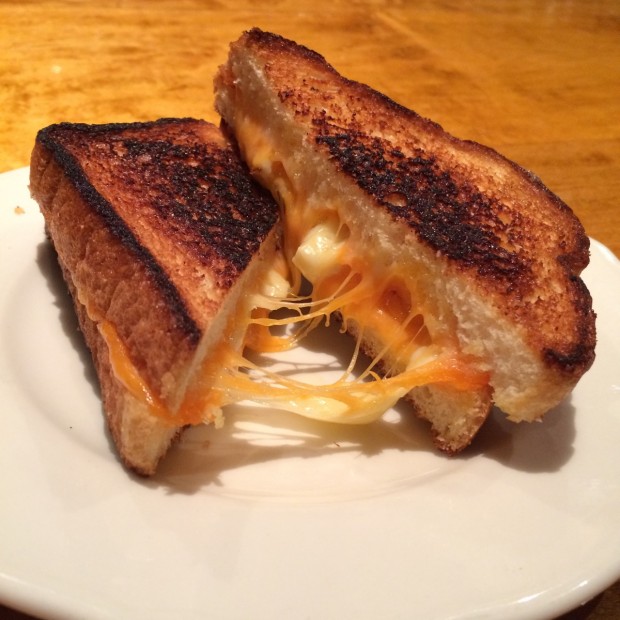
Where is `table wooden`? This screenshot has height=620, width=620. table wooden is located at coordinates (464, 64).